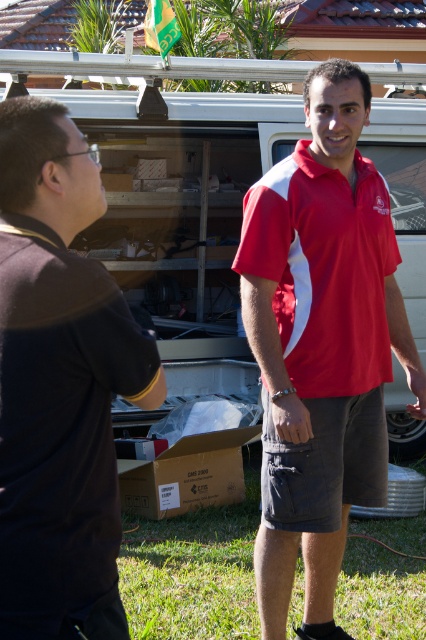
You are a photographer trying to capture a clear shot of the matte red polo shirt at center and the matte black truck at center. Based on their positions, which object is closer to the camera?

The matte red polo shirt at center is behind the matte black truck at center, so the matte black truck at center is closer to the camera.

You are standing at point [172,166] in the scene. What object is directly in front of you?

The matte black truck at center is directly in front of you at point [172,166].

You are a photographer trying to capture a photo of the red matte shirt at center and the matte black truck at center. Based on their sizes in the image, which object would appear larger in the photo?

The red matte shirt at center is taller than the matte black truck at center, so it would appear larger in the photo.